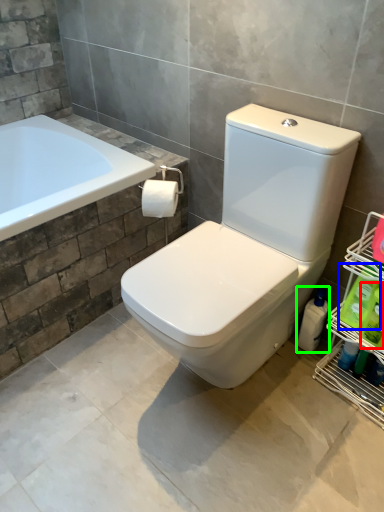
Question: Based on their relative distances, which object is nearer to cleaning product (highlighted by a red box)? Choose from cleaning product (highlighted by a blue box) and cleaning product (highlighted by a green box).

Choices:
 (A) cleaning product
 (B) cleaning product

Answer: (A)